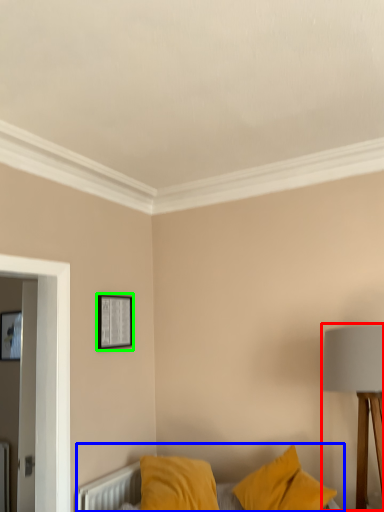
Question: Which object is the closest to the table lamp (highlighted by a red box)? Choose among these: bed (highlighted by a blue box) or picture frame (highlighted by a green box).

Choices:
 (A) bed
 (B) picture frame

Answer: (B)